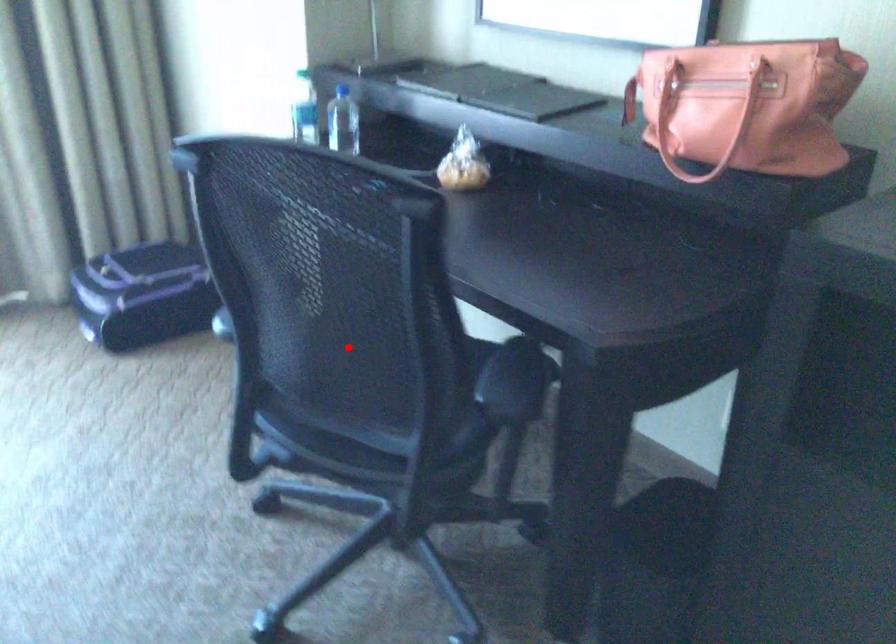
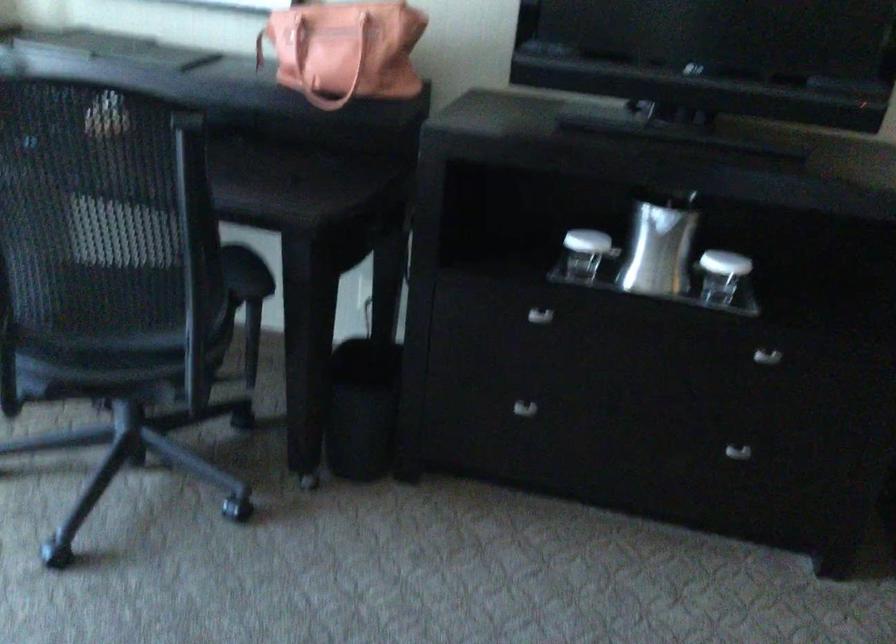
Question: A red point is marked in image1. In image2, is the corresponding 3D point closer to the camera or farther? Reply with the corresponding letter.

Choices:
 (A) The corresponding 3D point is closer.
 (B) The corresponding 3D point is farther.

Answer: (B)